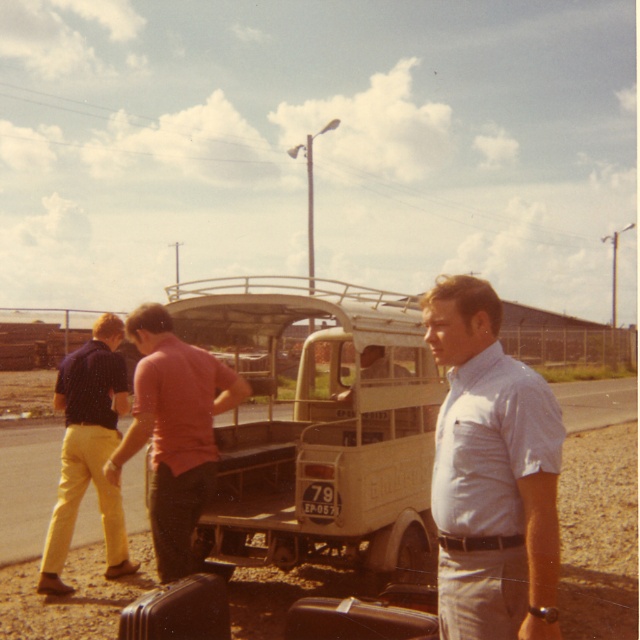
Can you confirm if beige matte truck at center is smaller than light blue shirt at center?

Incorrect, beige matte truck at center is not smaller in size than light blue shirt at center.

Does beige matte truck at center come behind light blue shirt at center?

Yes, it is.

Find the location of a particular element. The height and width of the screenshot is (640, 640). beige matte truck at center is located at coordinates (321, 428).

Where is `beige matte truck at center`? The width and height of the screenshot is (640, 640). beige matte truck at center is located at coordinates [x=321, y=428].

In the scene shown: Between matte pink shirt at center and yellow cotton pants at left, which one appears on the right side from the viewer's perspective?

Positioned to the right is matte pink shirt at center.

Can you confirm if matte pink shirt at center is bigger than yellow cotton pants at left?

Incorrect, matte pink shirt at center is not larger than yellow cotton pants at left.

Does point (170, 362) come farther from viewer compared to point (97, 484)?

No.

The image size is (640, 640). What are the coordinates of `matte pink shirt at center` in the screenshot? It's located at (173, 432).

Based on the photo, who is shorter, beige matte truck at center or yellow cotton pants at left?

yellow cotton pants at left

Is point (285, 317) positioned behind point (54, 406)?

No.

Describe the element at coordinates (321, 428) in the screenshot. I see `beige matte truck at center` at that location.

Locate an element on the screen. beige matte truck at center is located at coordinates (321, 428).